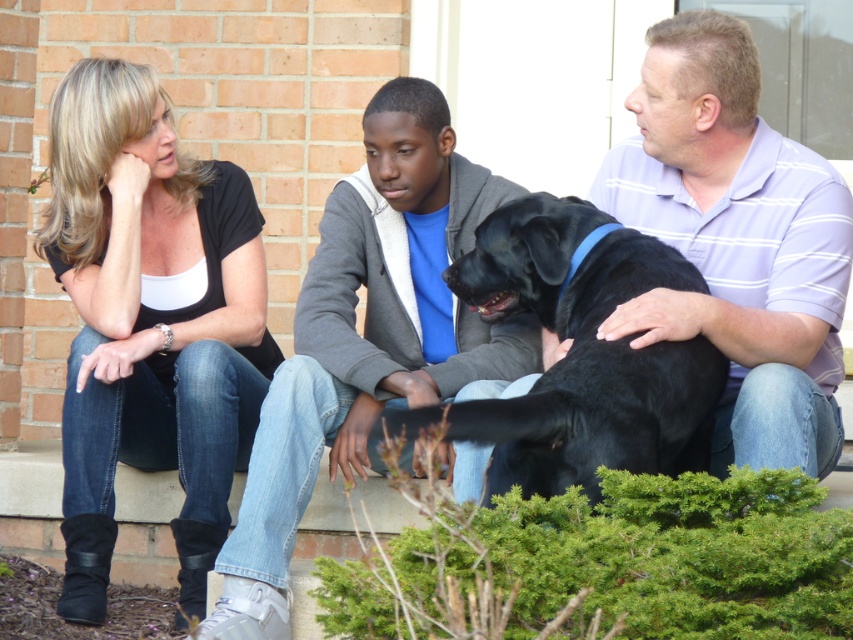
Can you confirm if smooth gray hoodie at center is bigger than black smooth dog at center?

Indeed, smooth gray hoodie at center has a larger size compared to black smooth dog at center.

Can you confirm if smooth gray hoodie at center is smaller than black smooth dog at center?

Incorrect, smooth gray hoodie at center is not smaller in size than black smooth dog at center.

Locate an element on the screen. This screenshot has width=853, height=640. smooth gray hoodie at center is located at coordinates (367, 337).

Locate an element on the screen. smooth gray hoodie at center is located at coordinates (367, 337).

Who is positioned more to the left, black matte/black jeans at left or smooth gray hoodie at center?

From the viewer's perspective, black matte/black jeans at left appears more on the left side.

The width and height of the screenshot is (853, 640). Find the location of `black matte/black jeans at left`. black matte/black jeans at left is located at coordinates 149,321.

Does matte purple shirt at center appear on the right side of smooth gray hoodie at center?

Correct, you'll find matte purple shirt at center to the right of smooth gray hoodie at center.

Is point (751, 216) positioned before point (300, 499)?

No, it is behind (300, 499).

Is point (718, 134) farther from viewer compared to point (422, 97)?

No.

The image size is (853, 640). I want to click on matte purple shirt at center, so click(x=735, y=241).